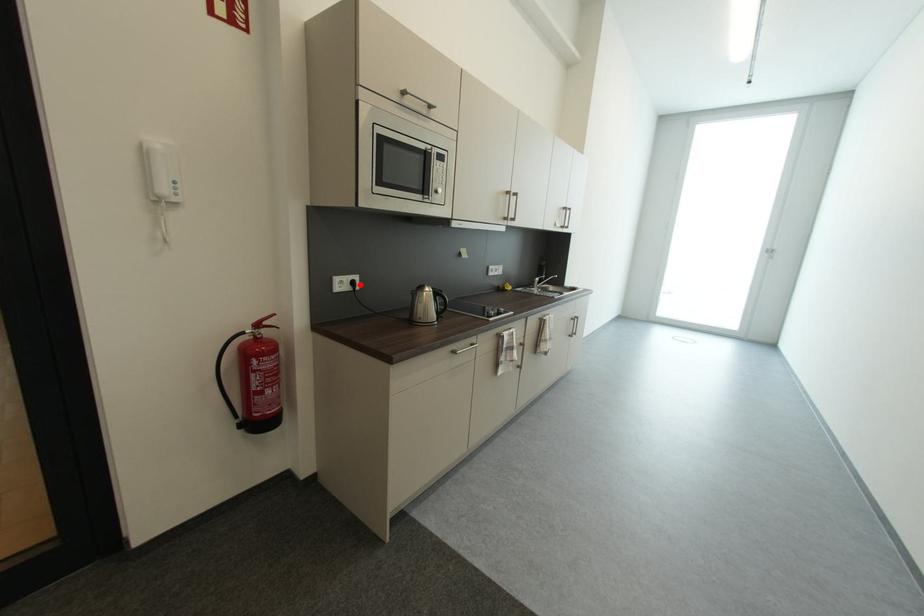
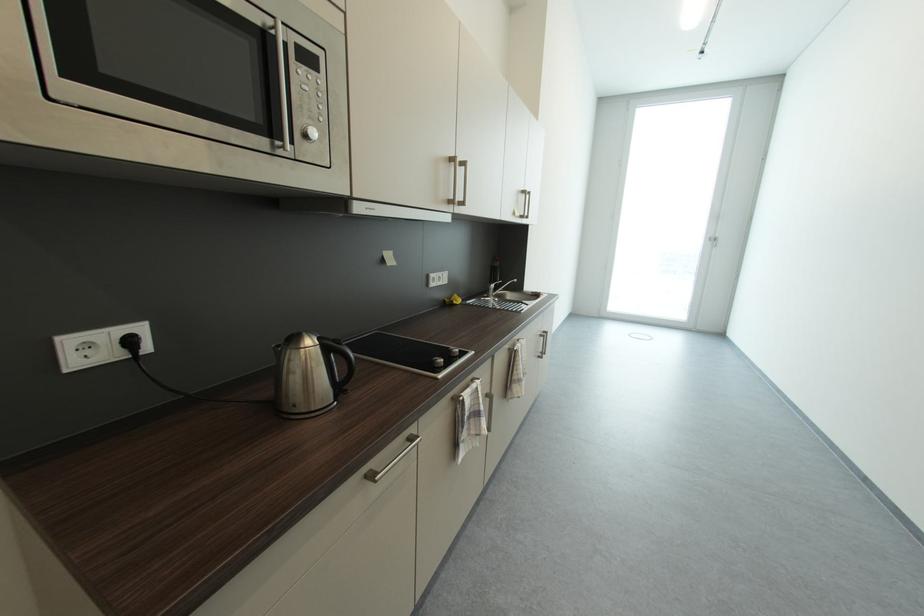
In the second image, find the point that corresponds to the highlighted location in the first image.

(137, 344)